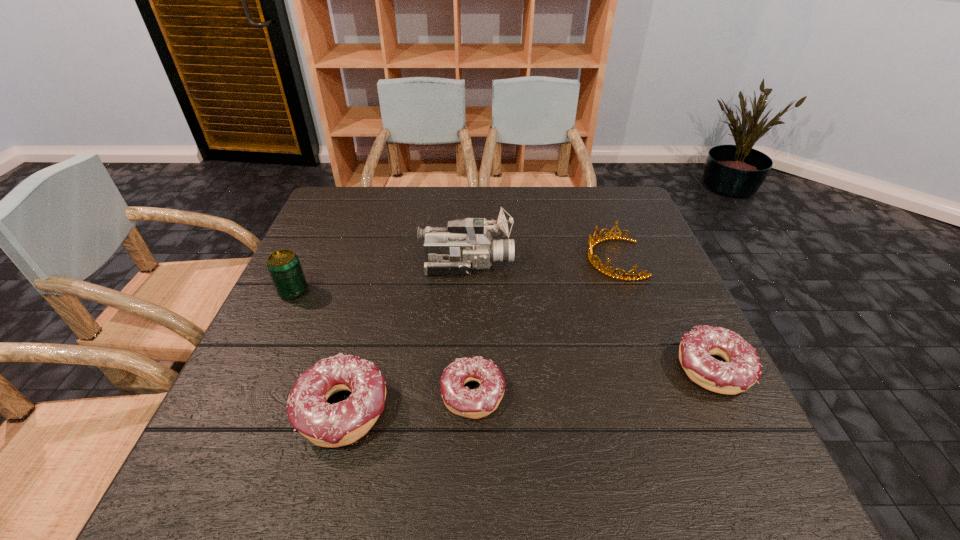
Locate an element on the screen. The image size is (960, 540). the fifth object from right to left is located at coordinates (329, 425).

Identify the location of the second doughnut from left to right. This screenshot has height=540, width=960. (476, 403).

The width and height of the screenshot is (960, 540). Find the location of `the shortest object`. the shortest object is located at coordinates (476, 403).

Where is `the second shortest object`? the second shortest object is located at coordinates (742, 369).

The height and width of the screenshot is (540, 960). I want to click on the rightmost doughnut, so click(742, 369).

At what (x,y) coordinates should I click in order to perform the action: click on camcorder. Please return your answer as a coordinate pair (x, y). This screenshot has width=960, height=540. Looking at the image, I should click on (467, 244).

Locate an element on the screen. The image size is (960, 540). tiara is located at coordinates (591, 243).

Locate an element on the screen. the second tallest object is located at coordinates (284, 267).

Locate an element on the screen. Image resolution: width=960 pixels, height=540 pixels. the leftmost object is located at coordinates (284, 267).

I want to click on free space located 0.310m on the right of the leftmost doughnut, so click(x=554, y=409).